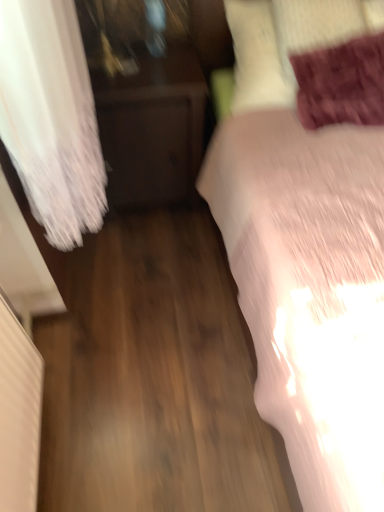
The height and width of the screenshot is (512, 384). Find the location of `velvet purple pillow at upper right`. velvet purple pillow at upper right is located at coordinates (317, 27).

Identify the location of white soft bed at right. This screenshot has height=512, width=384. (309, 234).

Locate an element on the screen. velvet purple pillow at upper right is located at coordinates (317, 27).

Which of these two, dark wood nightstand at left or white soft bed at right, is wider?

white soft bed at right.

Is dark wood nightstand at left outside of white soft bed at right?

Yes.

Is dark wood nightstand at left to the left of white soft bed at right from the viewer's perspective?

Yes, dark wood nightstand at left is to the left of white soft bed at right.

Based on the photo, from a real-world perspective, relative to white soft bed at right, is velvet purple pillow at upper right vertically above or below?

Clearly, from a real-world perspective, velvet purple pillow at upper right is above white soft bed at right.

Which object is positioned more to the left, velvet purple pillow at upper right or white soft bed at right?

Positioned to the left is velvet purple pillow at upper right.

Considering the positions of point (278, 15) and point (343, 213), is point (278, 15) closer or farther from the camera than point (343, 213)?

Point (278, 15) is farther from the camera than point (343, 213).

Considering the sizes of objects velvet purple pillow at upper right and white soft bed at right in the image provided, who is smaller, velvet purple pillow at upper right or white soft bed at right?

Smaller between the two is velvet purple pillow at upper right.

Can you confirm if dark wood nightstand at left is wider than velvet purple pillow at upper right?

Yes, dark wood nightstand at left is wider than velvet purple pillow at upper right.

From the image's perspective, between dark wood nightstand at left and velvet purple pillow at upper right, who is located below?

dark wood nightstand at left is shown below in the image.

In the image, is dark wood nightstand at left positioned in front of or behind velvet purple pillow at upper right?

Clearly, dark wood nightstand at left is behind velvet purple pillow at upper right.

How different are the orientations of white soft bed at right and velvet purple pillow at upper right in degrees?

4.31 degrees separate the facing orientations of white soft bed at right and velvet purple pillow at upper right.

Considering the sizes of objects white soft bed at right and velvet purple pillow at upper right in the image provided, who is shorter, white soft bed at right or velvet purple pillow at upper right?

velvet purple pillow at upper right.

Is white soft bed at right at the left side of velvet purple pillow at upper right?

No.

Where is `bed to the right of velvet purple pillow at upper right`? This screenshot has height=512, width=384. bed to the right of velvet purple pillow at upper right is located at coordinates (309, 234).

Which is more to the left, white soft bed at right or dark wood nightstand at left?

Positioned to the left is dark wood nightstand at left.

Considering the relative sizes of white soft bed at right and dark wood nightstand at left in the image provided, is white soft bed at right smaller than dark wood nightstand at left?

No.

Relative to dark wood nightstand at left, is white soft bed at right in front or behind?

white soft bed at right is in front of dark wood nightstand at left.

Is velvet purple pillow at upper right turned away from dark wood nightstand at left?

No, dark wood nightstand at left is not at the back of velvet purple pillow at upper right.

Which is closer, (352, 30) or (140, 51)?

The point (352, 30) is in front.

From a real-world perspective, relative to dark wood nightstand at left, is velvet purple pillow at upper right vertically above or below?

Clearly, from a real-world perspective, velvet purple pillow at upper right is above dark wood nightstand at left.

Is velvet purple pillow at upper right completely or partially outside of dark wood nightstand at left?

velvet purple pillow at upper right lies outside dark wood nightstand at left's area.

Identify the location of furniture located behind the white soft bed at right. Image resolution: width=384 pixels, height=512 pixels. coord(152,129).

At what (x,y) coordinates should I click in order to perform the action: click on pillow above the white soft bed at right (from a real-world perspective). Please return your answer as a coordinate pair (x, y). The width and height of the screenshot is (384, 512). Looking at the image, I should click on (317, 27).

Considering their positions, is velvet purple pillow at upper right positioned further to dark wood nightstand at left than white soft bed at right?

Based on the image, velvet purple pillow at upper right appears to be further to dark wood nightstand at left.

Estimate the real-world distances between objects in this image. Which object is further from white soft bed at right, dark wood nightstand at left or velvet purple pillow at upper right?

The object further to white soft bed at right is dark wood nightstand at left.

Looking at the image, which one is located further to velvet purple pillow at upper right, dark wood nightstand at left or white soft bed at right?

dark wood nightstand at left is positioned further to the anchor velvet purple pillow at upper right.

Which object lies further to the anchor point white soft bed at right, velvet purple pillow at upper right or dark wood nightstand at left?

Based on the image, dark wood nightstand at left appears to be further to white soft bed at right.

In the scene shown: Which object lies nearer to the anchor point dark wood nightstand at left, white soft bed at right or velvet purple pillow at upper right?

Among the two, white soft bed at right is located nearer to dark wood nightstand at left.

In the scene shown: From the image, which object appears to be farther from velvet purple pillow at upper right, white soft bed at right or dark wood nightstand at left?

dark wood nightstand at left is positioned further to the anchor velvet purple pillow at upper right.

The image size is (384, 512). Find the location of `pillow between white soft bed at right and dark wood nightstand at left in the front-back direction`. pillow between white soft bed at right and dark wood nightstand at left in the front-back direction is located at coordinates (317, 27).